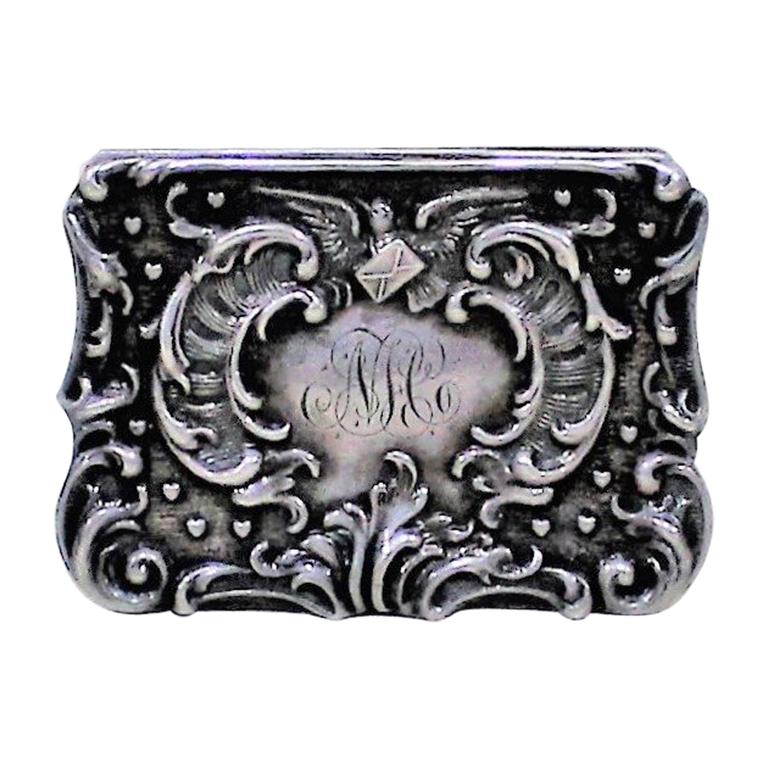
Image resolution: width=768 pixels, height=768 pixels. I want to click on top of pendant, so click(x=356, y=151).